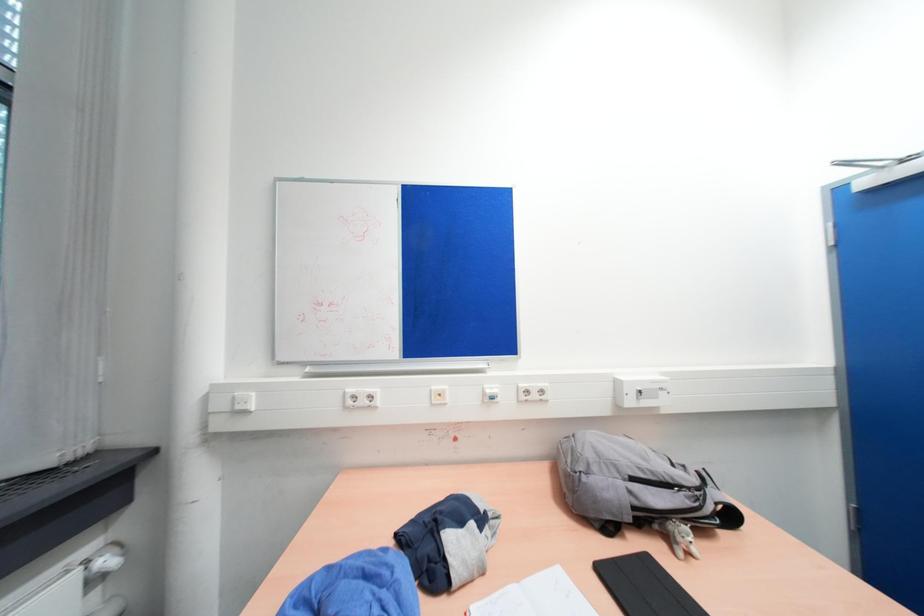
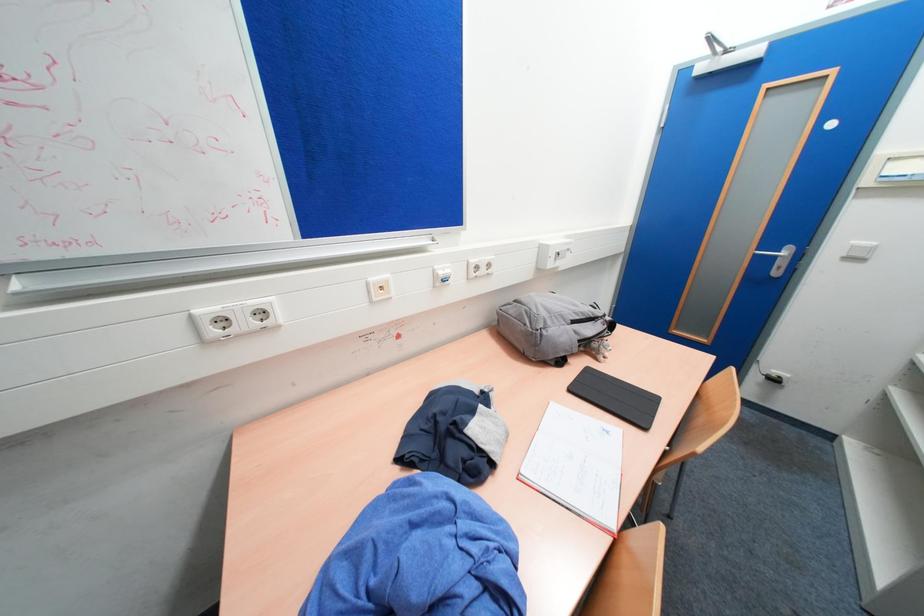
First-person continuous shooting, in which direction is the camera rotating?

The camera's rotation is toward right-down.